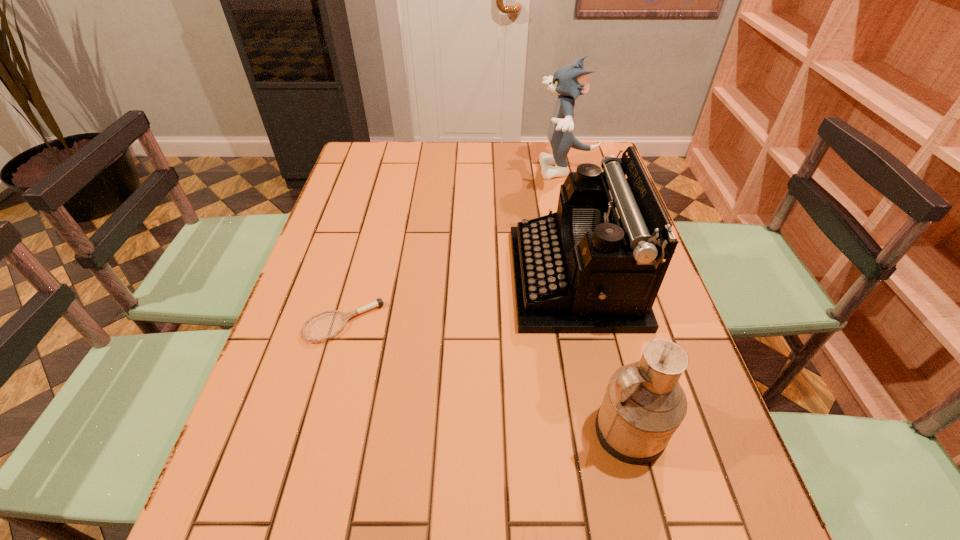
Identify the location of vacant space at the far edge. (434, 174).

You are a GUI agent. You are given a task and a screenshot of the screen. Output one action in this format:
    pyautogui.click(x=<x>, y=<y>)
    Task: Click on the blank space at the near edge of the desktop
    
    Given the screenshot: What is the action you would take?
    pyautogui.click(x=626, y=538)

You are a GUI agent. You are given a task and a screenshot of the screen. Output one action in this format:
    pyautogui.click(x=<x>, y=<y>)
    Task: Click on the vacant space at the left edge of the desktop
    Image resolution: width=960 pixels, height=540 pixels.
    Given the screenshot: What is the action you would take?
    pyautogui.click(x=283, y=359)

Where is `free location at the right edge`? The image size is (960, 540). free location at the right edge is located at coordinates (705, 399).

This screenshot has width=960, height=540. In the image, there is a desktop. Find the location of `vacant space at the far right corner`. vacant space at the far right corner is located at coordinates (588, 143).

The width and height of the screenshot is (960, 540). I want to click on vacant space that is in between the pitcher and the leftmost object, so click(486, 376).

You are a GUI agent. You are given a task and a screenshot of the screen. Output one action in this format:
    pyautogui.click(x=<x>, y=<y>)
    Task: Click on the vacant space in between the typewriter and the leftmost object
    This screenshot has height=540, width=960.
    Given the screenshot: What is the action you would take?
    pyautogui.click(x=459, y=300)

The width and height of the screenshot is (960, 540). Find the location of `vacant space in between the leftmost object and the farthest object`. vacant space in between the leftmost object and the farthest object is located at coordinates (456, 246).

Where is `free space between the shortest object and the pitcher`? The image size is (960, 540). free space between the shortest object and the pitcher is located at coordinates (486, 376).

This screenshot has width=960, height=540. I want to click on free space between the cat and the shortest object, so [x=456, y=246].